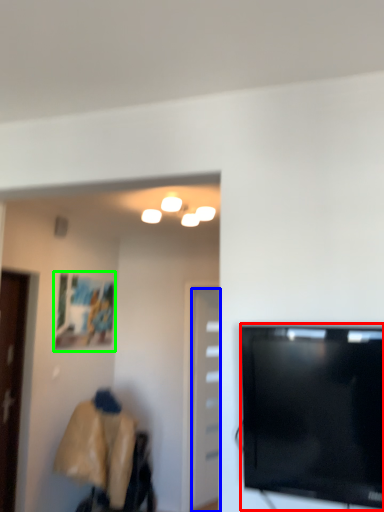
Question: Which object is positioned farthest from television (highlighted by a red box)? Select from door (highlighted by a blue box) and picture frame (highlighted by a green box).

Choices:
 (A) door
 (B) picture frame

Answer: (A)